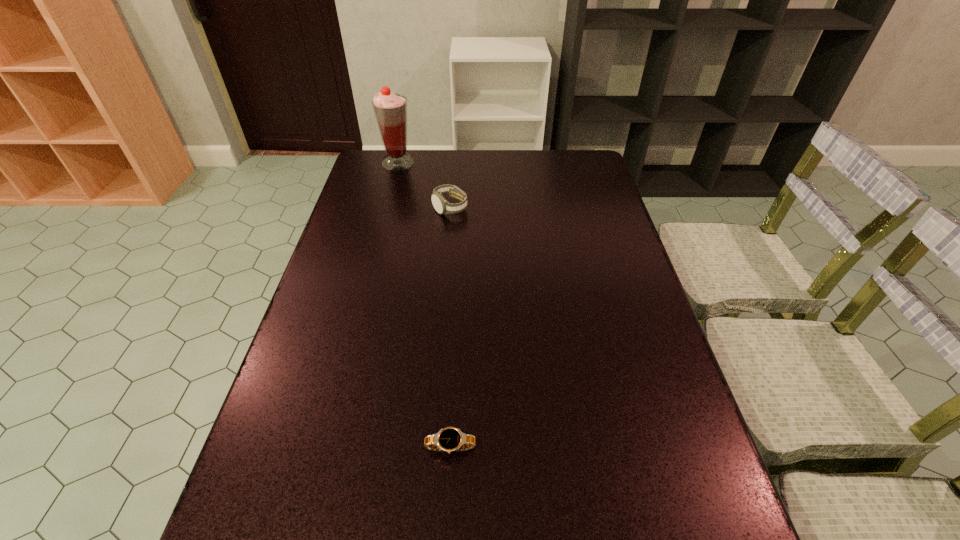
Locate an element on the screen. This screenshot has height=540, width=960. the tallest object is located at coordinates [x=390, y=109].

At what (x,y) coordinates should I click in order to perform the action: click on the farthest object. Please return your answer as a coordinate pair (x, y). Looking at the image, I should click on (390, 109).

The width and height of the screenshot is (960, 540). Identify the location of the second nearest object. (441, 205).

Find the location of a particular element. This screenshot has height=540, width=960. the second shortest object is located at coordinates (441, 205).

This screenshot has width=960, height=540. In order to click on the shortest object in this screenshot , I will do `click(450, 439)`.

Identify the location of the nearest object. (450, 439).

Find the location of `vacant region located on the front of the tallest object`. vacant region located on the front of the tallest object is located at coordinates (390, 193).

You are a GUI agent. You are given a task and a screenshot of the screen. Output one action in this format:
    pyautogui.click(x=<x>, y=<y>)
    Task: Click on the vacant space positioned 0.100m on the face of the second farthest object
    This screenshot has width=960, height=540.
    Given the screenshot: What is the action you would take?
    pyautogui.click(x=447, y=238)

Locate an element on the screen. free space located on the front of the shortest object is located at coordinates (447, 516).

Find the location of a particular element. Image resolution: width=960 pixels, height=540 pixels. object at the far edge is located at coordinates (390, 109).